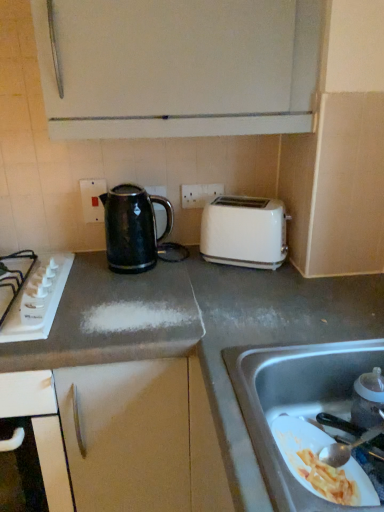
Describe the element at coordinates (132, 228) in the screenshot. I see `black glossy kettle at center` at that location.

Describe the element at coordinates (244, 232) in the screenshot. I see `white glossy toaster at upper right` at that location.

What is the approximate width of stainless steel sink at lower right?

The width of stainless steel sink at lower right is 14.84 inches.

Describe the element at coordinates (368, 399) in the screenshot. I see `transparent plastic baby bottle at lower right` at that location.

Find the location of a particular element. The image size is (384, 512). matte plastic electrical outlet at upper center, arranged as the 1th electric outlet when viewed from the left is located at coordinates (92, 199).

This screenshot has height=512, width=384. I want to click on matte black kettle at center, so coord(127,435).

Identify the location of black glossy kettle at center. Image resolution: width=384 pixels, height=512 pixels. (132, 228).

From the picture: Which of these two, white glossy toaster at upper right or transparent plastic baby bottle at lower right, is thinner?

Thinner between the two is transparent plastic baby bottle at lower right.

Is point (223, 205) closer or farther from the camera than point (364, 390)?

Point (223, 205) appears to be farther away from the viewer than point (364, 390).

In order to click on appliance below the white glossy toaster at upper right (from the image's perspective) in this screenshot , I will do `click(368, 399)`.

Is white glossy toaster at upper right not inside transparent plastic baby bottle at lower right?

Absolutely, white glossy toaster at upper right is external to transparent plastic baby bottle at lower right.

Is matte black kettle at center completely or partially inside white plastic electric outlet at center, the 2th electric outlet positioned from the left?

That's incorrect, matte black kettle at center is not inside white plastic electric outlet at center, the 2th electric outlet positioned from the left.

Which is less distant, (x=203, y=186) or (x=80, y=494)?

The point (x=80, y=494) is closer to the camera.

From the image's perspective, is white plastic electric outlet at center, the 2th electric outlet positioned from the left, beneath matte black kettle at center?

Incorrect, from the image's perspective, white plastic electric outlet at center, the 2th electric outlet positioned from the left, is higher than matte black kettle at center.

Who is taller, white plastic electric outlet at center, which is the 1th electric outlet from right to left, or matte black kettle at center?

matte black kettle at center.

Based on their positions, is transparent plastic baby bottle at lower right located to the left or right of white glossy toaster at upper right?

transparent plastic baby bottle at lower right is positioned on white glossy toaster at upper right's right side.

From a real-world perspective, is transparent plastic baby bottle at lower right above or below white glossy toaster at upper right?

In terms of real-world spatial position, transparent plastic baby bottle at lower right is below white glossy toaster at upper right.

From the image's perspective, which is above, transparent plastic baby bottle at lower right or white glossy toaster at upper right?

white glossy toaster at upper right is shown above in the image.

Can you confirm if transparent plastic baby bottle at lower right is wider than white glossy toaster at upper right?

Incorrect, the width of transparent plastic baby bottle at lower right does not surpass that of white glossy toaster at upper right.

Based on the photo, between black glossy kettle at center and white plastic electric outlet at center, which is the 1th electric outlet from right to left, which one has smaller width?

white plastic electric outlet at center, which is the 1th electric outlet from right to left, is thinner.

Would you say black glossy kettle at center is a long distance from white plastic electric outlet at center, the 2th electric outlet positioned from the left?

They are positioned close to each other.

Is point (111, 263) closer or farther from the camera than point (194, 198)?

Point (111, 263) is closer to the camera than point (194, 198).

How many degrees apart are the facing directions of black glossy kettle at center and white plastic electric outlet at center, the 2th electric outlet positioned from the left?

0.358 degrees.

From the picture: Is black glossy kettle at center outside of stainless steel sink at lower right?

black glossy kettle at center is positioned outside stainless steel sink at lower right.

Consider the image. Considering the positions of objects black glossy kettle at center and stainless steel sink at lower right in the image provided, who is more to the right, black glossy kettle at center or stainless steel sink at lower right?

Positioned to the right is stainless steel sink at lower right.

Is black glossy kettle at center further to the viewer compared to stainless steel sink at lower right?

Yes, the depth of black glossy kettle at center is greater than that of stainless steel sink at lower right.

Considering the positions of point (357, 418) and point (60, 414), is point (357, 418) closer or farther from the camera than point (60, 414)?

Point (357, 418) appears to be closer to the viewer than point (60, 414).

From their relative heights in the image, would you say transparent plastic baby bottle at lower right is taller or shorter than matte black kettle at center?

transparent plastic baby bottle at lower right is shorter than matte black kettle at center.

I want to click on sink below the black glossy kettle at center (from the image's perspective), so click(x=295, y=401).

Based on the photo, considering the sizes of objects stainless steel sink at lower right and black glossy kettle at center in the image provided, who is taller, stainless steel sink at lower right or black glossy kettle at center?

Standing taller between the two is black glossy kettle at center.

Can you see stainless steel sink at lower right touching black glossy kettle at center?

stainless steel sink at lower right is not next to black glossy kettle at center, and they're not touching.

Considering the sizes of objects stainless steel sink at lower right and black glossy kettle at center in the image provided, who is thinner, stainless steel sink at lower right or black glossy kettle at center?

With smaller width is black glossy kettle at center.

Where is `appliance below the white glossy toaster at upper right (from a real-world perspective)`? The width and height of the screenshot is (384, 512). appliance below the white glossy toaster at upper right (from a real-world perspective) is located at coordinates (368, 399).

The image size is (384, 512). What are the coordinates of `electric outlet located on the right of matte black kettle at center` in the screenshot? It's located at (x=199, y=194).

Looking at the image, which one is located further to white plastic gas stove at left, transparent plastic baby bottle at lower right or white plastic electric outlet at center, which is the 1th electric outlet from right to left?

transparent plastic baby bottle at lower right.

Estimate the real-world distances between objects in this image. Which object is closer to white plastic electric outlet at center, which is the 1th electric outlet from right to left, matte plastic electrical outlet at upper center, the 2th electric outlet when ordered from right to left, or black glossy kettle at center?

The object closer to white plastic electric outlet at center, which is the 1th electric outlet from right to left, is black glossy kettle at center.

Considering their positions, is black glossy kettle at center positioned closer to white plastic gas stove at left than matte plastic electrical outlet at upper center, the 2th electric outlet when ordered from right to left?

Based on the image, black glossy kettle at center appears to be nearer to white plastic gas stove at left.

Looking at this image, when comparing their distances from matte black kettle at center, does transparent plastic baby bottle at lower right or matte plastic electrical outlet at upper center, arranged as the 1th electric outlet when viewed from the left, seem closer?

transparent plastic baby bottle at lower right lies closer to matte black kettle at center than the other object.

From the image, which object appears to be farther from white glossy toaster at upper right, black glossy kettle at center or transparent plastic baby bottle at lower right?

transparent plastic baby bottle at lower right is further to white glossy toaster at upper right.

Which object lies nearer to the anchor point matte black kettle at center, white plastic gas stove at left or white plastic electric outlet at center, which is the 1th electric outlet from right to left?

white plastic gas stove at left lies closer to matte black kettle at center than the other object.

Based on their spatial positions, is black glossy kettle at center or white glossy toaster at upper right closer to white plastic gas stove at left?

black glossy kettle at center.

Looking at the image, which one is located further to black glossy kettle at center, matte plastic electrical outlet at upper center, the 2th electric outlet when ordered from right to left, or white plastic electric outlet at center, the 2th electric outlet positioned from the left?

white plastic electric outlet at center, the 2th electric outlet positioned from the left.

This screenshot has height=512, width=384. Find the location of `cabinetry between matte plastic electrical outlet at upper center, arranged as the 1th electric outlet when viewed from the left, and transparent plastic baby bottle at lower right`. cabinetry between matte plastic electrical outlet at upper center, arranged as the 1th electric outlet when viewed from the left, and transparent plastic baby bottle at lower right is located at coordinates (127, 435).

Where is `toaster between white plastic gas stove at left and stainless steel sink at lower right`? The width and height of the screenshot is (384, 512). toaster between white plastic gas stove at left and stainless steel sink at lower right is located at coordinates (244, 232).

Image resolution: width=384 pixels, height=512 pixels. What are the coordinates of `gas stove between matte plastic electrical outlet at upper center, the 2th electric outlet when ordered from right to left, and matte black kettle at center vertically` in the screenshot? It's located at (38, 298).

Where is `kettle between white plastic electric outlet at center, which is the 1th electric outlet from right to left, and matte black kettle at center, in the vertical direction`? The height and width of the screenshot is (512, 384). kettle between white plastic electric outlet at center, which is the 1th electric outlet from right to left, and matte black kettle at center, in the vertical direction is located at coordinates (132, 228).